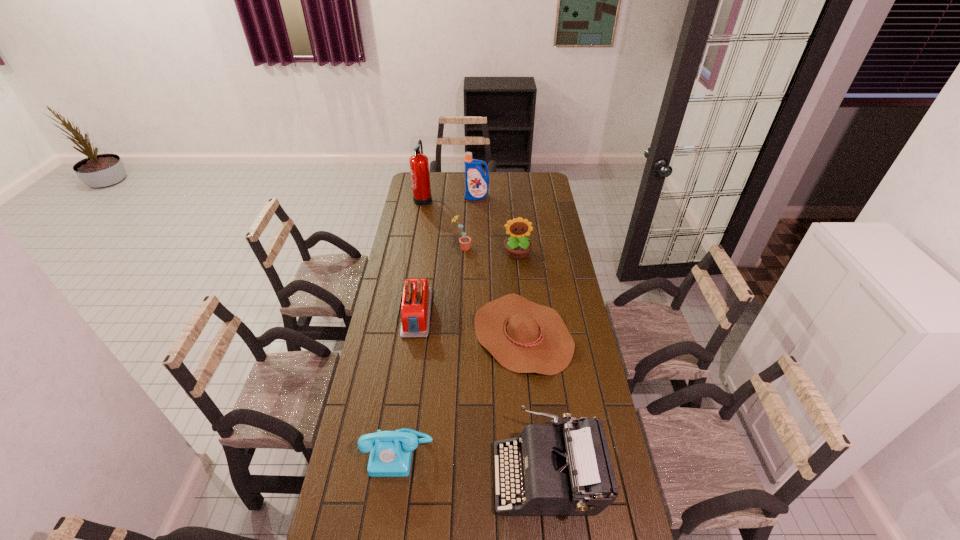
Locate an element on the screen. Image resolution: width=960 pixels, height=540 pixels. vacant space that satisfies the following two spatial constraints: 1. on the flower of the left sunflower; 2. on the right side of the shortest object is located at coordinates (458, 334).